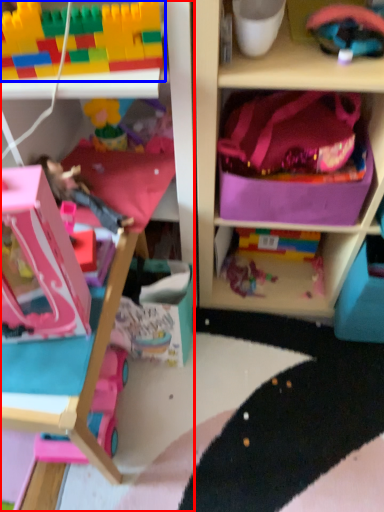
Question: Which point is further to the camera, cabinetry (highlighted by a red box) or toy (highlighted by a blue box)?

Choices:
 (A) cabinetry
 (B) toy

Answer: (A)